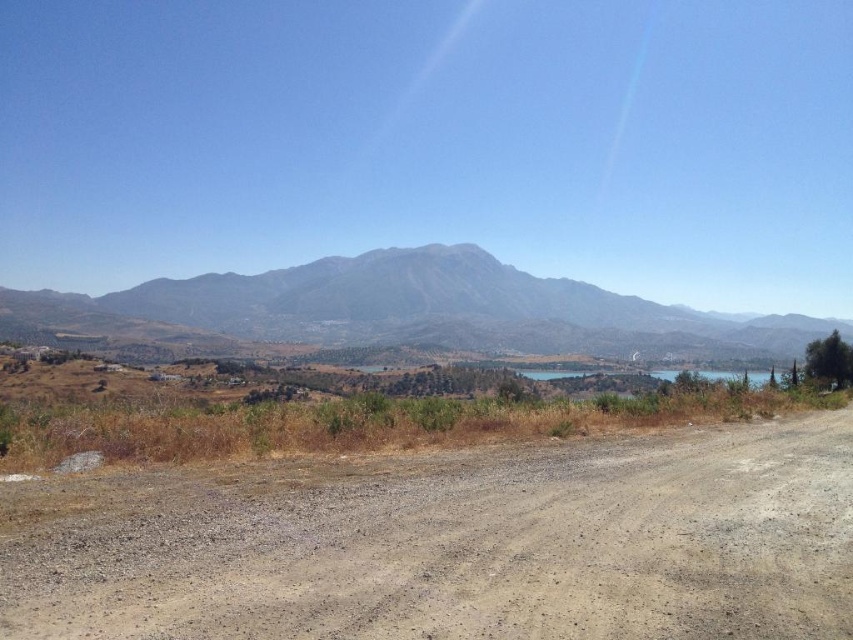
You are driving a car and want to reach the gray rocky mountain at center. The brown gravel dirt track at lower left is the only path available. Based on the scene, will the dirt track lead you directly towards the mountain?

The brown gravel dirt track at lower left is in front of gray rocky mountain at center, so yes, the dirt track will lead you directly towards the mountain.

You are planning to drive a large truck along the brown gravel dirt track at lower left and the gray rocky mountain at center. Which path is more suitable for your truck based on their sizes?

The gray rocky mountain at center is larger than the brown gravel dirt track at lower left, so the truck might have more space to navigate on the gray rocky mountain at center.